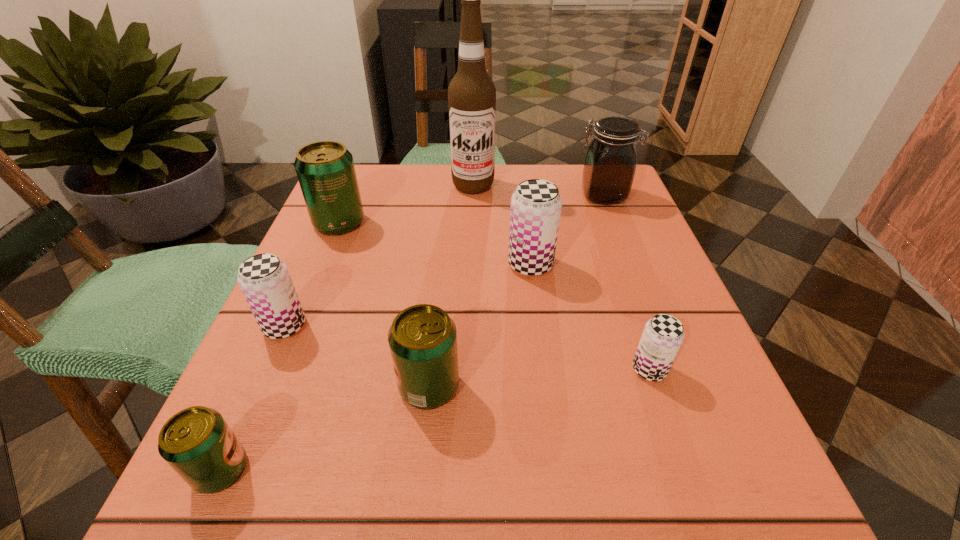
This screenshot has height=540, width=960. Identify the location of beer can that is the fourth closest to the tallest object. (422, 338).

Find the location of a particular element. the fourth closest beer can relative to the nearest purple beer can is located at coordinates (197, 443).

Where is `green beer can that is the closest to the alcohol`? This screenshot has width=960, height=540. green beer can that is the closest to the alcohol is located at coordinates (325, 169).

Locate an element on the screen. green beer can that is the second nearest to the farthest green beer can is located at coordinates (197, 443).

Locate an element on the screen. The height and width of the screenshot is (540, 960). the second closest purple beer can relative to the fourth beer can from left to right is located at coordinates (536, 204).

This screenshot has width=960, height=540. In order to click on purple beer can that is the third closest one to the biggest green beer can in this screenshot , I will do 663,335.

Identify the location of vacant area that satisfies the following two spatial constraints: 1. on the lid of the jar; 2. on the front side of the rightmost green beer can. (677, 386).

Where is `vacant region that satisfies the following two spatial constraints: 1. on the label of the alcohol; 2. on the right side of the smallest purple beer can`? The width and height of the screenshot is (960, 540). vacant region that satisfies the following two spatial constraints: 1. on the label of the alcohol; 2. on the right side of the smallest purple beer can is located at coordinates (468, 369).